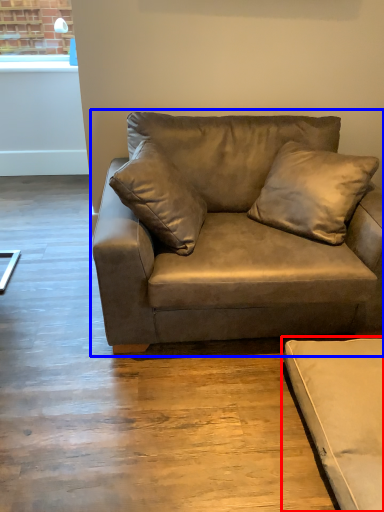
Question: Among these objects, which one is farthest to the camera, studio couch (highlighted by a red box) or studio couch (highlighted by a blue box)?

Choices:
 (A) studio couch
 (B) studio couch

Answer: (B)